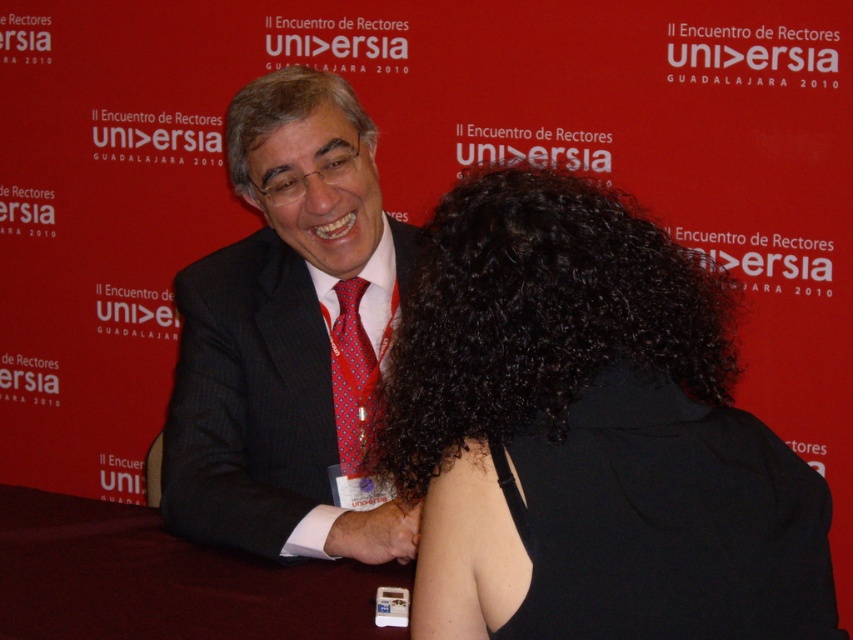
Is dark gray suit at center smaller than red silk tie at center?

No.

Does dark gray suit at center appear on the left side of red silk tie at center?

Yes, dark gray suit at center is to the left of red silk tie at center.

Is point (334, 524) positioned after point (361, 289)?

No, (334, 524) is in front of (361, 289).

I want to click on dark gray suit at center, so point(287,333).

Can you confirm if dark gray suit at center is bigger than gray curly hair at center?

Indeed, dark gray suit at center has a larger size compared to gray curly hair at center.

Who is higher up, dark gray suit at center or gray curly hair at center?

Positioned higher is gray curly hair at center.

In order to click on dark gray suit at center in this screenshot , I will do `click(287, 333)`.

Find the location of a particular element. The width and height of the screenshot is (853, 640). dark gray suit at center is located at coordinates (287, 333).

Which of these two, black curly hair at center or gray curly hair at center, stands taller?

black curly hair at center

Which is above, black curly hair at center or gray curly hair at center?

gray curly hair at center is above.

This screenshot has height=640, width=853. I want to click on black curly hair at center, so click(587, 433).

Where is `black curly hair at center`? This screenshot has width=853, height=640. black curly hair at center is located at coordinates (587, 433).